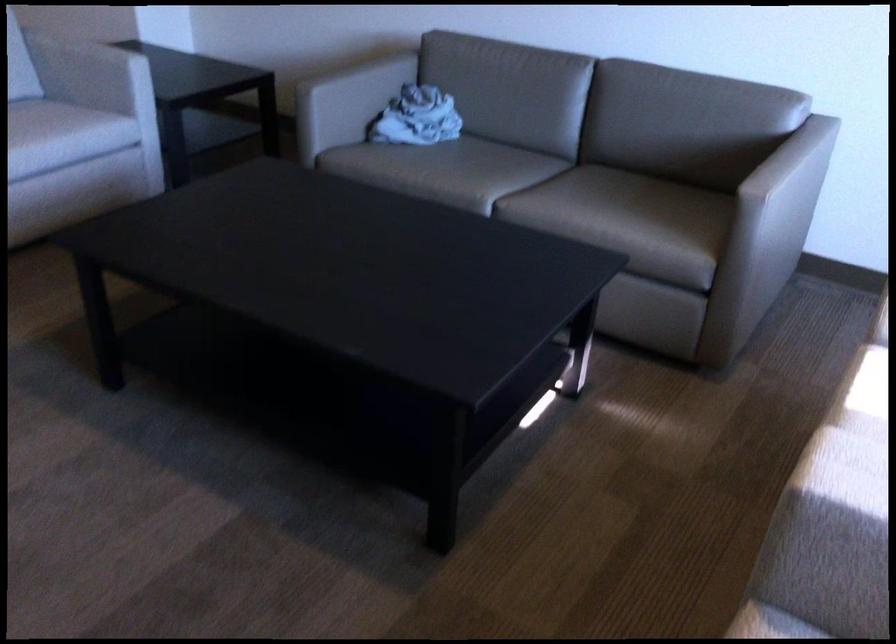
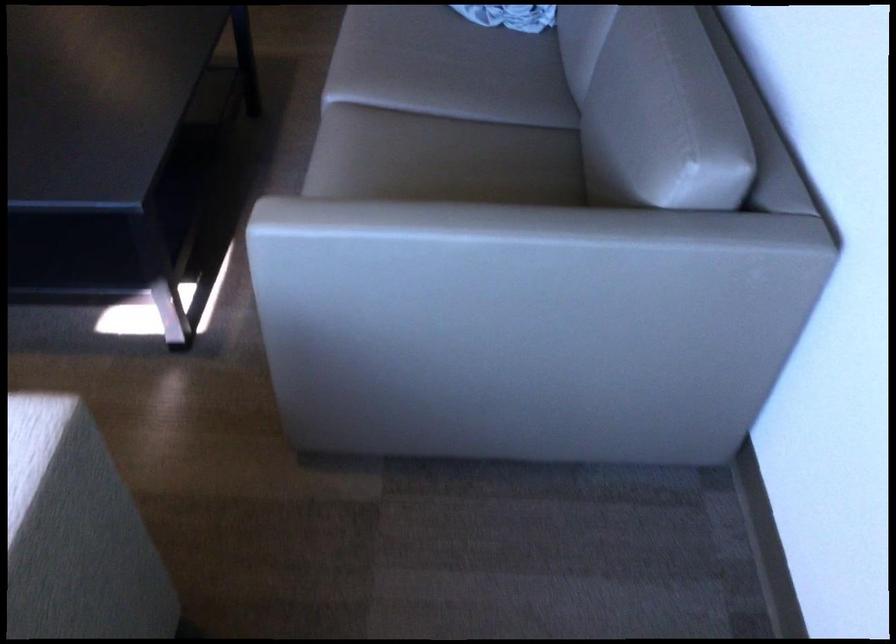
The point at (x=791, y=162) is marked in the first image. Where is the corresponding point in the second image?

(485, 249)